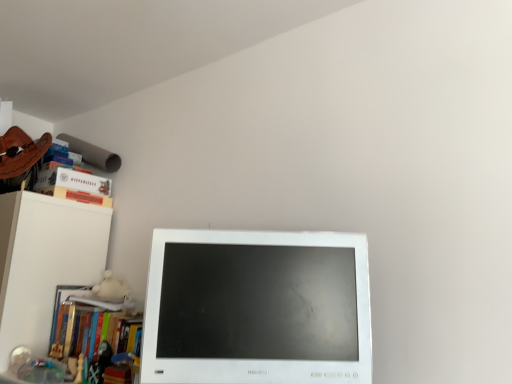
What do you see at coordinates (257, 308) in the screenshot? The image size is (512, 384). I see `white glossy computer monitor at center` at bounding box center [257, 308].

What is the approximate width of hardcover book at upper left, which is counted as the second paperback book, starting from the top?

hardcover book at upper left, which is counted as the second paperback book, starting from the top, is 7.32 inches in width.

What do you see at coordinates (77, 196) in the screenshot?
I see `hardcover book at upper left, which is counted as the second paperback book, starting from the top` at bounding box center [77, 196].

This screenshot has width=512, height=384. I want to click on white glossy computer monitor at center, so click(x=257, y=308).

Can you confirm if wooden chess piece at lower left is positioned to the left of hardcover book at upper left, which is counted as the second paperback book, starting from the top?

No.

From the image's perspective, relative to hardcover book at upper left, which is counted as the first paperback book, starting from the bottom, is wooden chess piece at lower left above or below?

wooden chess piece at lower left is situated lower than hardcover book at upper left, which is counted as the first paperback book, starting from the bottom, in the image.

Considering the positions of points (80, 381) and (102, 199), is point (80, 381) farther from camera compared to point (102, 199)?

No, it is in front of (102, 199).

Can you confirm if wooden chess piece at lower left is shorter than hardcover book at upper left, which is counted as the first paperback book, starting from the bottom?

In fact, wooden chess piece at lower left may be taller than hardcover book at upper left, which is counted as the first paperback book, starting from the bottom.

Considering the sizes of objects white glossy computer monitor at center and hardcover book at upper left, arranged as the 2th paperback book when ordered from the bottom, in the image provided, who is taller, white glossy computer monitor at center or hardcover book at upper left, arranged as the 2th paperback book when ordered from the bottom,?

With more height is white glossy computer monitor at center.

Starting from the white glossy computer monitor at center, which paperback book is the 2nd one to the left? Please provide its 2D coordinates.

[(80, 181)]

Is wooden chess piece at lower left to the right of white glossy computer monitor at center from the viewer's perspective?

No.

Does wooden chess piece at lower left have a smaller size compared to white glossy computer monitor at center?

Yes.

Is wooden chess piece at lower left oriented towards white glossy computer monitor at center?

Answer: No, wooden chess piece at lower left is not oriented towards white glossy computer monitor at center.

From the image's perspective, does wooden chess piece at lower left appear higher than white glossy computer monitor at center?

No, from the image's perspective, wooden chess piece at lower left is not above white glossy computer monitor at center.

From a real-world perspective, is white matte book at lower left, arranged as the first book when viewed from the top, positioned under wooden chess piece at lower left based on gravity?

No, from a real-world perspective, white matte book at lower left, arranged as the first book when viewed from the top, is not beneath wooden chess piece at lower left.

The width and height of the screenshot is (512, 384). What are the coordinates of `the 2nd book above the wooden chess piece at lower left (from the image's perspective)` in the screenshot? It's located at (96, 301).

Considering the positions of objects hardcover book at upper left, which is counted as the second paperback book, starting from the top, and hardcover book at left, the first book from the bottom, in the image provided, who is more to the left, hardcover book at upper left, which is counted as the second paperback book, starting from the top, or hardcover book at left, the first book from the bottom,?

Positioned to the left is hardcover book at upper left, which is counted as the second paperback book, starting from the top.

From a real-world perspective, is hardcover book at upper left, which is counted as the first paperback book, starting from the bottom, positioned over hardcover book at left, the first book from the bottom, based on gravity?

Indeed, from a real-world perspective, hardcover book at upper left, which is counted as the first paperback book, starting from the bottom, stands above hardcover book at left, the first book from the bottom.

Does hardcover book at upper left, which is counted as the first paperback book, starting from the bottom, have a lesser width compared to hardcover book at left, the first book from the bottom?

Indeed, hardcover book at upper left, which is counted as the first paperback book, starting from the bottom, has a lesser width compared to hardcover book at left, the first book from the bottom.

At what (x,y) coordinates should I click in order to perform the action: click on computer monitor located in front of the hardcover book at left, the first book from the bottom. Please return your answer as a coordinate pair (x, y). Looking at the image, I should click on (257, 308).

Considering the relative sizes of hardcover book at left, the first book from the bottom, and white glossy computer monitor at center in the image provided, is hardcover book at left, the first book from the bottom, shorter than white glossy computer monitor at center?

Yes.

Does hardcover book at left, which is the second book in top-to-bottom order, have a greater width compared to white glossy computer monitor at center?

Correct, the width of hardcover book at left, which is the second book in top-to-bottom order, exceeds that of white glossy computer monitor at center.

From a real-world perspective, between hardcover book at left, which is the second book in top-to-bottom order, and white glossy computer monitor at center, who is vertically higher?

From a 3D spatial view, white glossy computer monitor at center is above.

Is wooden chess piece at lower left bigger or smaller than hardcover book at left, which is the second book in top-to-bottom order?

wooden chess piece at lower left is smaller than hardcover book at left, which is the second book in top-to-bottom order.

Is wooden chess piece at lower left taller or shorter than hardcover book at left, which is the second book in top-to-bottom order?

Considering their sizes, wooden chess piece at lower left has less height than hardcover book at left, which is the second book in top-to-bottom order.

How different are the orientations of wooden chess piece at lower left and hardcover book at left, which is the second book in top-to-bottom order, in degrees?

The angle between the facing direction of wooden chess piece at lower left and the facing direction of hardcover book at left, which is the second book in top-to-bottom order, is 1.2 degrees.

Is the position of wooden chess piece at lower left more distant than that of hardcover book at left, which is the second book in top-to-bottom order?

That is True.

From a real-world perspective, which paperback book is the 1st one above the wooden chess piece at lower left? Please provide its 2D coordinates.

[(77, 196)]

In order to click on the 2nd paperback book counting from the left side of the white glossy computer monitor at center in this screenshot , I will do `click(80, 181)`.

Which object lies further to the anchor point white matte book at lower left, arranged as the first book when viewed from the top, wooden chess piece at lower left or hardcover book at upper left, which is counted as the second paperback book, starting from the top?

Based on the image, hardcover book at upper left, which is counted as the second paperback book, starting from the top, appears to be further to white matte book at lower left, arranged as the first book when viewed from the top.

Based on their spatial positions, is white matte book at lower left, arranged as the first book when viewed from the top, or hardcover book at left, which is the second book in top-to-bottom order, further from wooden chess piece at lower left?

Among the two, white matte book at lower left, arranged as the first book when viewed from the top, is located further to wooden chess piece at lower left.

Which object lies nearer to the anchor point wooden chess piece at lower left, white matte book at lower left, marked as the 2th book in a bottom-to-top arrangement, or white glossy computer monitor at center?

Based on the image, white matte book at lower left, marked as the 2th book in a bottom-to-top arrangement, appears to be nearer to wooden chess piece at lower left.

Based on their spatial positions, is wooden chess piece at lower left or hardcover book at left, which is the second book in top-to-bottom order, closer to white glossy computer monitor at center?

The object closer to white glossy computer monitor at center is hardcover book at left, which is the second book in top-to-bottom order.

Based on their spatial positions, is hardcover book at upper left, which is counted as the second paperback book, starting from the top, or hardcover book at left, the first book from the bottom, further from white matte book at lower left, arranged as the first book when viewed from the top?

hardcover book at upper left, which is counted as the second paperback book, starting from the top, lies further to white matte book at lower left, arranged as the first book when viewed from the top, than the other object.

Which object lies nearer to the anchor point white glossy computer monitor at center, white matte book at lower left, arranged as the first book when viewed from the top, or hardcover book at left, the first book from the bottom?

Among the two, hardcover book at left, the first book from the bottom, is located nearer to white glossy computer monitor at center.

From the picture: Considering their positions, is white matte book at lower left, marked as the 2th book in a bottom-to-top arrangement, positioned closer to wooden chess piece at lower left than hardcover book at upper left, which is counted as the second paperback book, starting from the top?

white matte book at lower left, marked as the 2th book in a bottom-to-top arrangement, is closer to wooden chess piece at lower left.

Which object lies further to the anchor point white matte book at lower left, marked as the 2th book in a bottom-to-top arrangement, white glossy computer monitor at center or wooden chess piece at lower left?

The object further to white matte book at lower left, marked as the 2th book in a bottom-to-top arrangement, is white glossy computer monitor at center.

The image size is (512, 384). What are the coordinates of `toy between white matte book at lower left, marked as the 2th book in a bottom-to-top arrangement, and white glossy computer monitor at center` in the screenshot? It's located at (80, 368).

The image size is (512, 384). I want to click on toy between hardcover book at upper left, the 1th paperback book viewed from the top, and white glossy computer monitor at center, in the horizontal direction, so [x=80, y=368].

This screenshot has height=384, width=512. Find the location of `paperback book between hardcover book at upper left, arranged as the 2th paperback book when ordered from the bottom, and white matte book at lower left, arranged as the first book when viewed from the top, from top to bottom`. paperback book between hardcover book at upper left, arranged as the 2th paperback book when ordered from the bottom, and white matte book at lower left, arranged as the first book when viewed from the top, from top to bottom is located at coordinates (77, 196).

Locate an element on the screen. paperback book situated between hardcover book at upper left, arranged as the 2th paperback book when ordered from the bottom, and white glossy computer monitor at center from left to right is located at coordinates (77, 196).